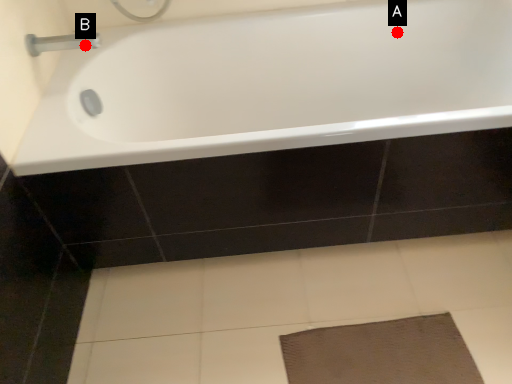
Question: Two points are circled on the image, labeled by A and B beside each circle. Which point is closer to the camera taking this photo?

Choices:
 (A) A is closer
 (B) B is closer

Answer: (B)